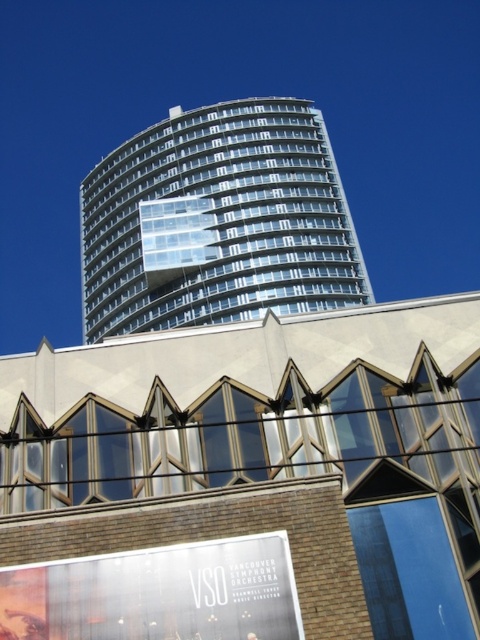
You are a drone operator planning to fly a drone from the transparent glass building at upper center to the white glossy billboard at lower center. The drone has a maximum flight range of 300 feet. Can the drone reach the billboard without needing a recharge?

A: The distance between the transparent glass building at upper center and the white glossy billboard at lower center is 367.62 feet, which exceeds the drone maximum flight range of 300 feet. Therefore, the drone cannot reach the billboard without needing a recharge.

You are standing at the entrance of the Vancouver Symphony Orchestra building and want to locate the transparent glass building at upper center. According to the image, where exactly is it positioned?

The transparent glass building at upper center is located at point (217, 221).

You are standing in front of the Vancouver Symphony Orchestra building and want to locate the transparent glass building at upper center and the white glossy billboard at lower center. Which object is positioned to the left of the other?

The transparent glass building at upper center is positioned to the left of the white glossy billboard at lower center.